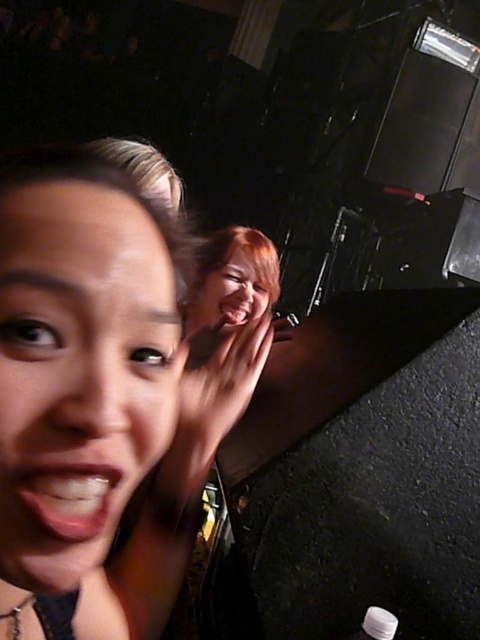
Question: Which point is farther from the camera taking this photo?

Choices:
 (A) click(48, 385)
 (B) click(228, 305)
 (C) click(362, 634)

Answer: (B)

Question: Is matte skin face at left above smooth skin face at upper center?

Choices:
 (A) yes
 (B) no

Answer: (B)

Question: Which point appears farthest from the camera in this image?

Choices:
 (A) (393, 620)
 (B) (25, 280)

Answer: (A)

Question: Does matte skin face at left appear over white matte bottle at lower right?

Choices:
 (A) yes
 (B) no

Answer: (A)

Question: Which object appears closest to the camera in this image?

Choices:
 (A) white matte bottle at lower right
 (B) matte skin face at left
 (C) smooth skin face at upper center

Answer: (B)

Question: Can you confirm if matte skin face at left is bigger than smooth skin face at upper center?

Choices:
 (A) yes
 (B) no

Answer: (B)